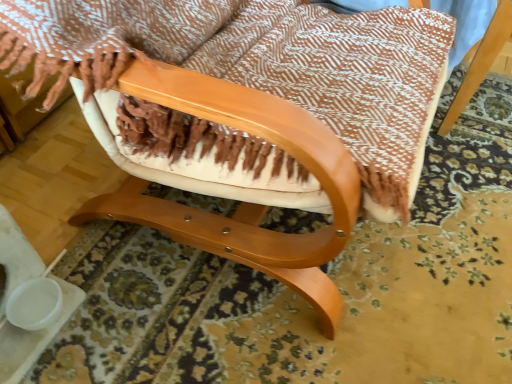
Image resolution: width=512 pixels, height=384 pixels. What do you see at coordinates (28, 302) in the screenshot? I see `white plastic bowl at lower left` at bounding box center [28, 302].

Find the location of a particular element. The width and height of the screenshot is (512, 384). white plastic bowl at lower left is located at coordinates (28, 302).

Identify the location of white plastic bowl at lower left. The height and width of the screenshot is (384, 512). (28, 302).